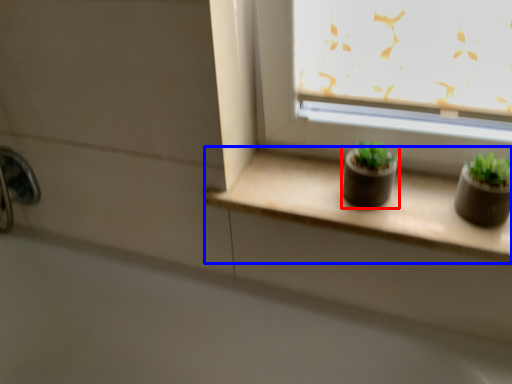
Question: Which point is closer to the camera, flowerpot (highlighted by a red box) or window sill (highlighted by a blue box)?

Choices:
 (A) flowerpot
 (B) window sill

Answer: (B)